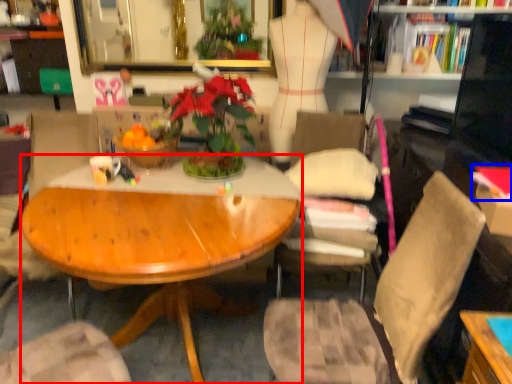
Question: Which object appears closest to the camera in this image, desk (highlighted by a red box) or book (highlighted by a blue box)?

Choices:
 (A) desk
 (B) book

Answer: (A)